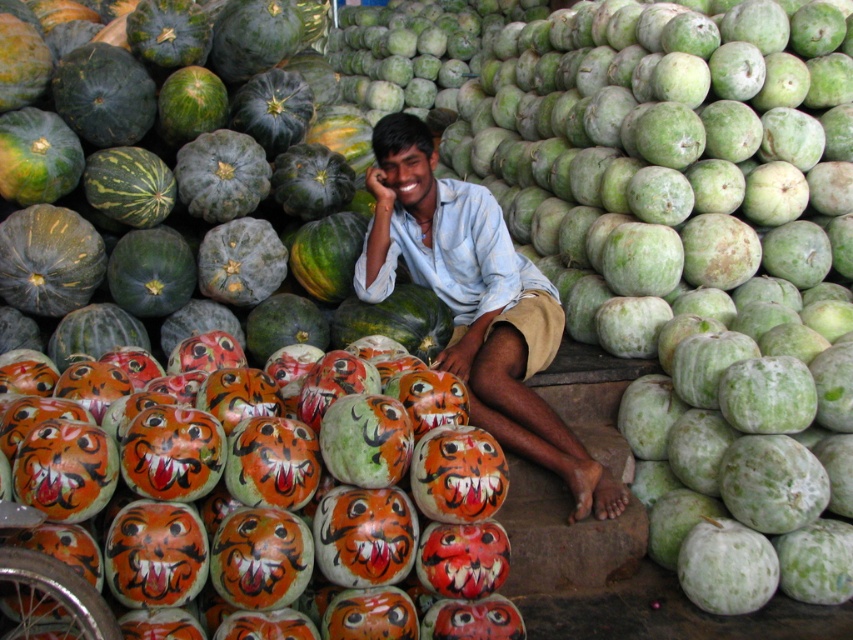
Question: Is painted orange pumpkin at center to the left of light blue shirt at center from the viewer's perspective?

Choices:
 (A) yes
 (B) no

Answer: (A)

Question: Is painted orange pumpkin at center smaller than light blue shirt at center?

Choices:
 (A) yes
 (B) no

Answer: (A)

Question: Can you confirm if painted orange pumpkin at center is positioned to the left of light blue shirt at center?

Choices:
 (A) yes
 (B) no

Answer: (A)

Question: Which point is farther to the camera?

Choices:
 (A) light blue shirt at center
 (B) painted orange pumpkin at center

Answer: (A)